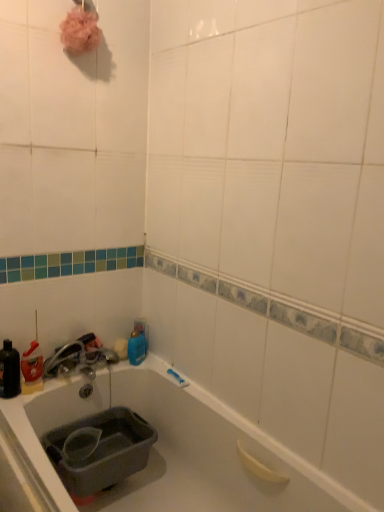
Question: Is satin nickel faucet at lower left situated inside blue glossy bottle at upper center, placed as the 2th bottle when sorted from front to back, or outside?

Choices:
 (A) outside
 (B) inside

Answer: (A)

Question: From a real-world perspective, is satin nickel faucet at lower left positioned above or below blue glossy bottle at upper center, the second bottle from the left?

Choices:
 (A) below
 (B) above

Answer: (B)

Question: Which is nearer to the matte black bottle at left, which appears as the second bottle when viewed from the right?

Choices:
 (A) gray plastic sink at lower left
 (B) blue glossy bottle at upper center, which is counted as the 1th bottle, starting from the back
 (C) satin nickel faucet at lower left

Answer: (C)

Question: Based on their relative distances, which object is farther from the gray plastic sink at lower left?

Choices:
 (A) blue glossy bottle at upper center, the second bottle from the left
 (B) matte black bottle at left, which ranks as the second bottle in back-to-front order
 (C) satin nickel faucet at lower left

Answer: (A)